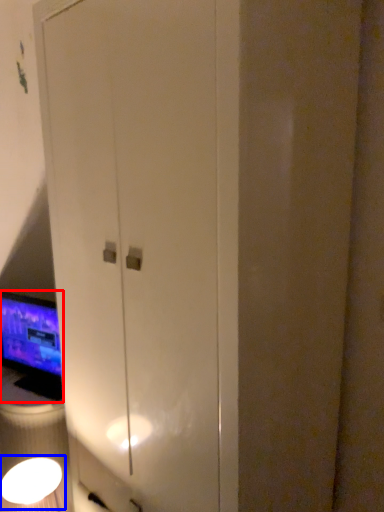
Question: Among these objects, which one is farthest to the camera, computer monitor (highlighted by a red box) or light fixture (highlighted by a blue box)?

Choices:
 (A) computer monitor
 (B) light fixture

Answer: (A)